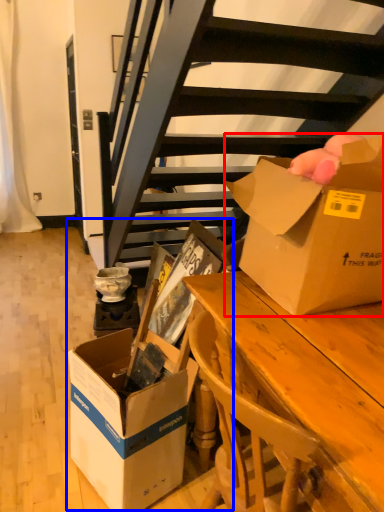
Question: Which object is further to the camera taking this photo, box (highlighted by a red box) or storage box (highlighted by a blue box)?

Choices:
 (A) box
 (B) storage box

Answer: (B)